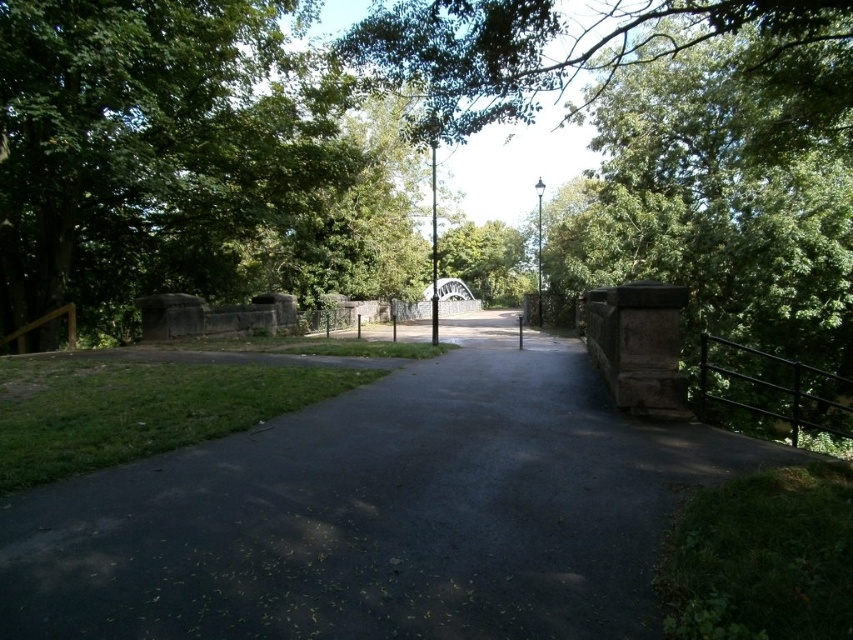
Question: Which object is the farthest from the dark asphalt path at center?

Choices:
 (A) green leafy tree at upper center
 (B) green leafy tree at left

Answer: (A)

Question: Does dark asphalt path at center appear over green leafy tree at left?

Choices:
 (A) no
 (B) yes

Answer: (A)

Question: Considering the real-world distances, which object is closest to the green leafy tree at left?

Choices:
 (A) dark asphalt path at center
 (B) green leafy tree at upper center

Answer: (A)

Question: Can you confirm if green leafy tree at left is thinner than green leafy tree at upper center?

Choices:
 (A) no
 (B) yes

Answer: (B)

Question: Where is dark asphalt path at center located in relation to green leafy tree at upper center in the image?

Choices:
 (A) below
 (B) above

Answer: (A)

Question: Which point is farther to the camera?

Choices:
 (A) green leafy tree at upper center
 (B) green leafy tree at left

Answer: (B)